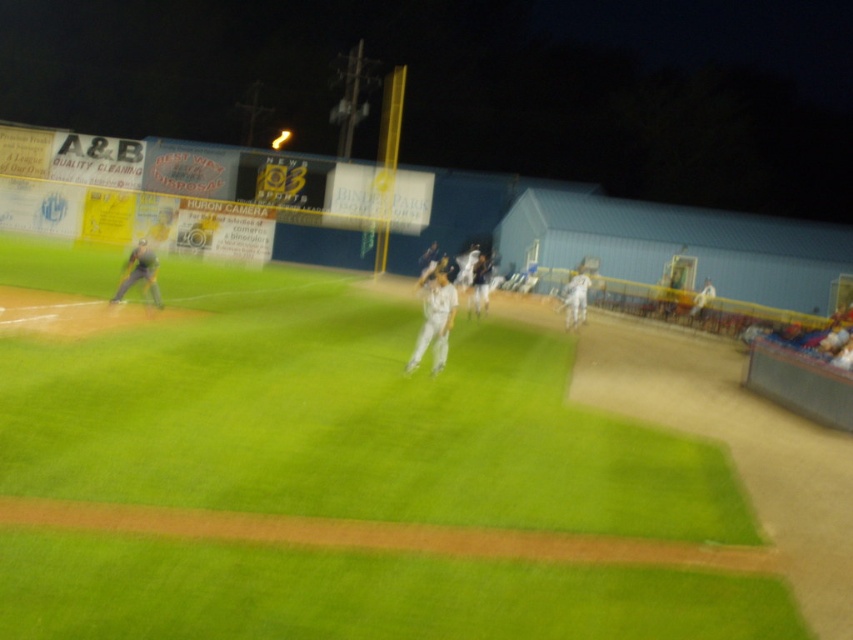
Question: From the image, what is the correct spatial relationship of white uniform at center in relation to dark gray uniform at left?

Choices:
 (A) above
 (B) below

Answer: (B)

Question: Considering the relative positions of white uniform at center and dark gray uniform at left in the image provided, where is white uniform at center located with respect to dark gray uniform at left?

Choices:
 (A) above
 (B) below

Answer: (B)

Question: Among these objects, which one is nearest to the camera?

Choices:
 (A) white uniform at center
 (B) dark gray uniform at left

Answer: (A)

Question: Observing the image, what is the correct spatial positioning of white uniform at center in reference to dark gray uniform at left?

Choices:
 (A) right
 (B) left

Answer: (A)